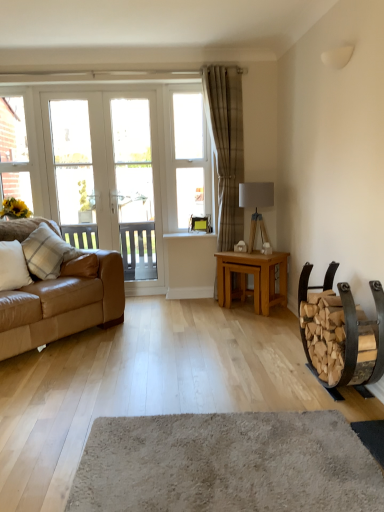
This screenshot has height=512, width=384. What do you see at coordinates (256, 206) in the screenshot?
I see `matte gray lamp at center` at bounding box center [256, 206].

The image size is (384, 512). In order to click on matte gray lamp at center in this screenshot , I will do `click(256, 206)`.

Where is `white plastic window frame at upper left, which is the 1th window frame in left-to-right order`? The width and height of the screenshot is (384, 512). white plastic window frame at upper left, which is the 1th window frame in left-to-right order is located at coordinates (x=14, y=151).

Locate an element on the screen. The image size is (384, 512). light oak table at center is located at coordinates (254, 278).

I want to click on white plaid pillow at left, the 2th pillow viewed from the back, so click(x=13, y=266).

This screenshot has width=384, height=512. I want to click on matte gray lamp at center, so click(x=256, y=206).

From a real-world perspective, is matte gray lamp at center positioned above or below soft beige carpet at center?

Clearly, from a real-world perspective, matte gray lamp at center is above soft beige carpet at center.

Is the surface of matte gray lamp at center in direct contact with soft beige carpet at center?

No, matte gray lamp at center is not making contact with soft beige carpet at center.

Which object is closer to the camera, matte gray lamp at center or soft beige carpet at center?

soft beige carpet at center is closer to the camera.

From the image's perspective, does matte gray lamp at center appear lower than soft beige carpet at center?

Incorrect, from the image's perspective, matte gray lamp at center is higher than soft beige carpet at center.

Looking at this image, is light oak table at center touching soft beige carpet at center?

No, light oak table at center is not making contact with soft beige carpet at center.

In the scene shown: From a real-world perspective, which object stands above the other?

From a 3D spatial view, light oak table at center is above.

From the image's perspective, is light oak table at center above or below soft beige carpet at center?

Based on their image positions, light oak table at center is located above soft beige carpet at center.

In terms of height, does light oak table at center look taller or shorter compared to soft beige carpet at center?

Clearly, light oak table at center is taller compared to soft beige carpet at center.

Considering the relative sizes of soft beige carpet at center and white glass door at left in the image provided, is soft beige carpet at center bigger than white glass door at left?

No, soft beige carpet at center is not bigger than white glass door at left.

In the scene shown: Is soft beige carpet at center shorter than white glass door at left?

Correct, soft beige carpet at center is not as tall as white glass door at left.

From the picture: From a real-world perspective, is soft beige carpet at center positioned above or below white glass door at left?

In terms of real-world spatial position, soft beige carpet at center is below white glass door at left.

Based on the photo, which is closer to the camera, (211, 470) or (91, 96)?

Clearly, point (211, 470) is closer to the camera than point (91, 96).

Between beige textured curtain at center and white plastic window frame at upper left, which is the 1th window frame in left-to-right order, which one appears on the left side from the viewer's perspective?

white plastic window frame at upper left, which is the 1th window frame in left-to-right order, is more to the left.

Considering the sizes of objects beige textured curtain at center and white plastic window frame at upper left, the 2th window frame viewed from the right, in the image provided, who is taller, beige textured curtain at center or white plastic window frame at upper left, the 2th window frame viewed from the right,?

beige textured curtain at center is taller.

Locate an element on the screen. Image resolution: width=384 pixels, height=512 pixels. the 2nd window frame located above the beige textured curtain at center (from a real-world perspective) is located at coordinates 14,151.

Can you tell me how much beige textured curtain at center and white plastic window frame at upper left, which is the 1th window frame in left-to-right order, differ in facing direction?

They differ by 1.05 degrees in their facing directions.

Between white glass screen door at center and light oak table at center, which one has larger size?

white glass screen door at center is bigger.

Visually, is white glass screen door at center positioned to the left or to the right of light oak table at center?

Based on their positions, white glass screen door at center is located to the left of light oak table at center.

Considering the sizes of objects white glass screen door at center and light oak table at center in the image provided, who is shorter, white glass screen door at center or light oak table at center?

light oak table at center is shorter.

Is wooden log rack at right inside soft beige carpet at center?

No.

From the image's perspective, which one is positioned higher, soft beige carpet at center or wooden log rack at right?

wooden log rack at right.

Which object is more forward, soft beige carpet at center or wooden log rack at right?

soft beige carpet at center is in front.

Between soft beige carpet at center and wooden log rack at right, which one has larger size?

With larger size is wooden log rack at right.

From a real-world perspective, relative to wooden log rack at right, is white plastic window frame at upper left, which is the 1th window frame in left-to-right order, vertically above or below?

white plastic window frame at upper left, which is the 1th window frame in left-to-right order, is situated higher than wooden log rack at right in the real world.

Which object is closer to the camera, white plastic window frame at upper left, which is the 1th window frame in left-to-right order, or wooden log rack at right?

wooden log rack at right.

Between white plastic window frame at upper left, which is the 1th window frame in left-to-right order, and wooden log rack at right, which one appears on the right side from the viewer's perspective?

Positioned to the right is wooden log rack at right.

Does white plastic window frame at upper left, which is the 1th window frame in left-to-right order, have a lesser width compared to wooden log rack at right?

Yes.

The width and height of the screenshot is (384, 512). In order to click on lamp that is on the right side of soft beige carpet at center in this screenshot , I will do `click(256, 206)`.

What are the coordinates of `plain below the light oak table at center (from the image's perspective)` in the screenshot? It's located at (227, 464).

Which object lies nearer to the anchor point white plaid pillow at left, marked as the 1th pillow in a front-to-back arrangement, wooden log rack at right or matte gray lamp at center?

matte gray lamp at center is positioned closer to the anchor white plaid pillow at left, marked as the 1th pillow in a front-to-back arrangement.

Which object lies nearer to the anchor point white plastic window frame at upper left, the 2th window frame viewed from the right, matte gray lamp at center or white plastic window at upper center, which is the second window frame in left-to-right order?

white plastic window at upper center, which is the second window frame in left-to-right order, is closer to white plastic window frame at upper left, the 2th window frame viewed from the right.

Estimate the real-world distances between objects in this image. Which object is closer to white plastic window frame at upper left, which is the 1th window frame in left-to-right order, matte gray lamp at center or white glass screen door at center?

The object closer to white plastic window frame at upper left, which is the 1th window frame in left-to-right order, is white glass screen door at center.

From the image, which object appears to be farther from light oak table at center, white plaid pillow at left, the 2th pillow viewed from the back, or plaid fabric pillow at left, marked as the 1th pillow in a back-to-front arrangement?

Among the two, white plaid pillow at left, the 2th pillow viewed from the back, is located further to light oak table at center.

From the image, which object appears to be nearer to wooden log rack at right, white plastic window at upper center, which is the second window frame in left-to-right order, or beige textured curtain at center?

beige textured curtain at center is positioned closer to the anchor wooden log rack at right.

Based on their spatial positions, is white glass door at left or beige textured curtain at center closer to soft beige carpet at center?

beige textured curtain at center is positioned closer to the anchor soft beige carpet at center.

Estimate the real-world distances between objects in this image. Which object is closer to beige textured curtain at center, white glass screen door at center or soft beige carpet at center?

Among the two, white glass screen door at center is located nearer to beige textured curtain at center.

Based on their spatial positions, is white glass screen door at center or white plaid pillow at left, the 2th pillow viewed from the back, further from plaid fabric pillow at left, placed as the second pillow when sorted from front to back?

white glass screen door at center.

The image size is (384, 512). In order to click on table located between white glass screen door at center and matte gray lamp at center in the left-right direction in this screenshot , I will do `click(254, 278)`.

I want to click on studio couch located between soft beige carpet at center and white glass screen door at center in the depth direction, so click(x=62, y=305).

The height and width of the screenshot is (512, 384). What are the coordinates of `curtain located between white plaid pillow at left, the 2th pillow viewed from the back, and light oak table at center in the left-right direction` in the screenshot? It's located at (226, 150).

The image size is (384, 512). Identify the location of window frame located between white plaid pillow at left, marked as the 1th pillow in a front-to-back arrangement, and beige textured curtain at center in the left-right direction. (188, 158).